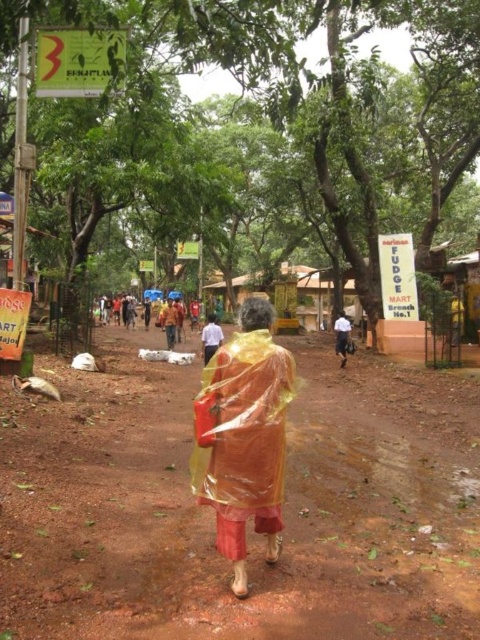
Is brown dirt field at center to the left of transparent yellow raincoat at center from the viewer's perspective?

Yes, brown dirt field at center is to the left of transparent yellow raincoat at center.

Looking at this image, who is more distant from viewer, (50, 374) or (233, 417)?

The point (50, 374) is behind.

At what (x,y) coordinates should I click in order to perform the action: click on brown dirt field at center. Please return your answer as a coordinate pair (x, y). The width and height of the screenshot is (480, 640). Looking at the image, I should click on (213, 515).

Does point (288, 400) lie behind point (339, 364)?

No, it is not.

Based on the photo, which is above, transparent yellow raincoat at center or yellow translucent raincoat at center?

yellow translucent raincoat at center

Locate an element on the screen. transparent yellow raincoat at center is located at coordinates [x=245, y=436].

From the picture: Is brown dirt field at center smaller than yellow translucent raincoat at center?

Actually, brown dirt field at center might be larger than yellow translucent raincoat at center.

Can you confirm if brown dirt field at center is positioned to the right of yellow translucent raincoat at center?

Incorrect, brown dirt field at center is not on the right side of yellow translucent raincoat at center.

Find the location of `brown dirt field at center`. brown dirt field at center is located at coordinates (213, 515).

Where is `brown dirt field at center`? This screenshot has width=480, height=640. brown dirt field at center is located at coordinates (213, 515).